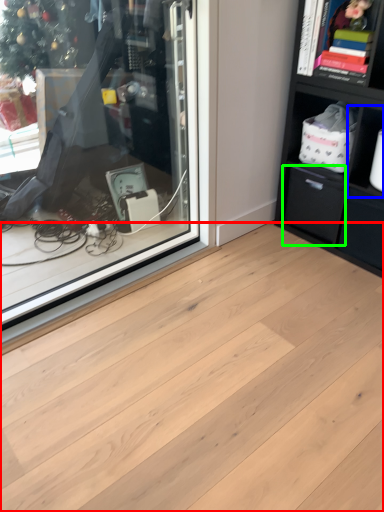
Question: Based on their relative distances, which object is nearer to plank (highlighted by a red box)? Choose from cabinet (highlighted by a blue box) and drawer (highlighted by a green box).

Choices:
 (A) cabinet
 (B) drawer

Answer: (B)